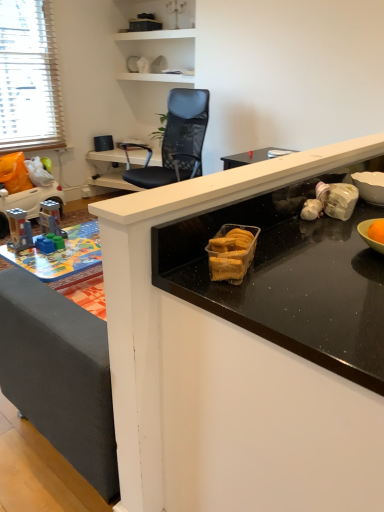
Question: Considering the relative sizes of black glossy countertop at center and black mesh chair at upper center in the image provided, is black glossy countertop at center wider than black mesh chair at upper center?

Choices:
 (A) no
 (B) yes

Answer: (A)

Question: Does black glossy countertop at center have a larger size compared to black mesh chair at upper center?

Choices:
 (A) no
 (B) yes

Answer: (B)

Question: From the image's perspective, would you say black glossy countertop at center is shown under black mesh chair at upper center?

Choices:
 (A) no
 (B) yes

Answer: (B)

Question: Are black glossy countertop at center and black mesh chair at upper center far apart?

Choices:
 (A) yes
 (B) no

Answer: (A)

Question: From the image's perspective, is black glossy countertop at center located above black mesh chair at upper center?

Choices:
 (A) yes
 (B) no

Answer: (B)

Question: From a real-world perspective, is black glossy countertop at center on top of black mesh chair at upper center?

Choices:
 (A) yes
 (B) no

Answer: (A)

Question: Does plastic toy car at left, the 1th toy viewed from the back, lie behind black mesh chair at upper center?

Choices:
 (A) yes
 (B) no

Answer: (A)

Question: Is plastic toy car at left, the 1th toy viewed from the back, looking in the opposite direction of black mesh chair at upper center?

Choices:
 (A) no
 (B) yes

Answer: (A)

Question: Is plastic toy car at left, marked as the first toy in a top-to-bottom arrangement, outside of black mesh chair at upper center?

Choices:
 (A) no
 (B) yes

Answer: (B)

Question: Considering the relative positions of plastic toy car at left, marked as the first toy in a top-to-bottom arrangement, and black mesh chair at upper center in the image provided, is plastic toy car at left, marked as the first toy in a top-to-bottom arrangement, to the right of black mesh chair at upper center from the viewer's perspective?

Choices:
 (A) no
 (B) yes

Answer: (A)

Question: Is black mesh chair at upper center surrounded by plastic toy car at left, marked as the first toy in a top-to-bottom arrangement?

Choices:
 (A) no
 (B) yes

Answer: (A)

Question: Can you confirm if plastic toy car at left, placed as the first toy when sorted from left to right, is taller than black mesh chair at upper center?

Choices:
 (A) yes
 (B) no

Answer: (B)

Question: Is black mesh chair at upper center inside black mesh chair at upper center?

Choices:
 (A) no
 (B) yes

Answer: (A)